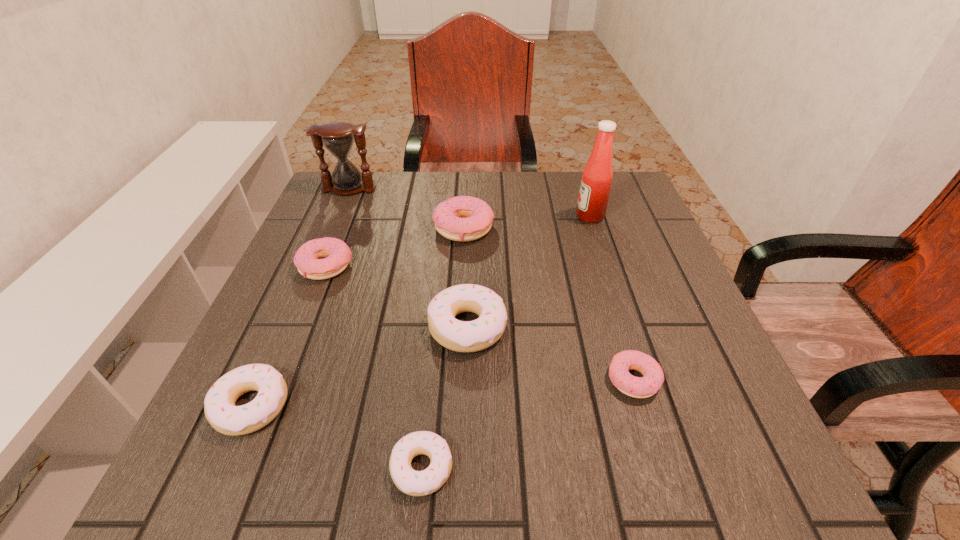
Find the location of a particular element. Image resolution: width=960 pixels, height=540 pixels. vacant position located 0.130m on the right of the leftmost white doughnut is located at coordinates (369, 406).

You are a GUI agent. You are given a task and a screenshot of the screen. Output one action in this format:
    pyautogui.click(x=<x>, y=<y>)
    Task: Click on the free space located on the left of the smallest pink doughnut
    
    Given the screenshot: What is the action you would take?
    tap(378, 380)

At what (x,y) coordinates should I click in order to perform the action: click on vacant space situated 0.250m on the left of the smallest white doughnut. Please return your answer as a coordinate pair (x, y). The width and height of the screenshot is (960, 540). Looking at the image, I should click on (219, 468).

Locate an element on the screen. condiment that is at the far edge is located at coordinates (597, 176).

Where is `hourglass at the far edge`? hourglass at the far edge is located at coordinates tap(338, 138).

Where is `doughnut present at the far edge`? The image size is (960, 540). doughnut present at the far edge is located at coordinates (463, 218).

The image size is (960, 540). Find the location of `hourglass present at the left edge`. hourglass present at the left edge is located at coordinates (338, 138).

I want to click on condiment at the right edge, so click(x=597, y=176).

Find the location of `doughnut located at the right edge`. doughnut located at the right edge is located at coordinates (653, 377).

Find the location of `object present at the far left corner`. object present at the far left corner is located at coordinates (338, 138).